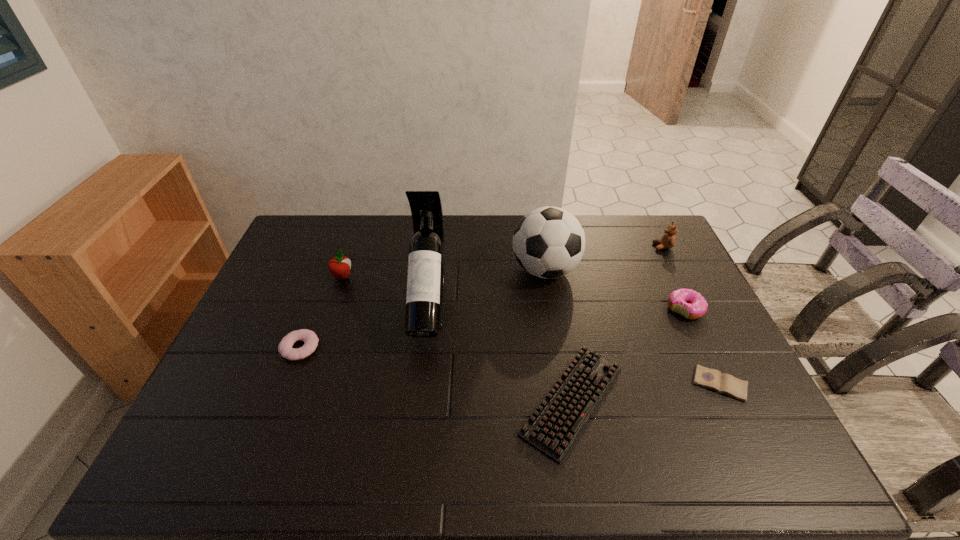
Locate an element on the screen. free point at the near edge is located at coordinates (565, 476).

Identify the location of free spot at the left edge of the desktop. (245, 369).

In order to click on vacant space at the right edge in this screenshot , I will do `click(770, 422)`.

The image size is (960, 540). In the image, there is a desktop. What are the coordinates of `free space at the far left corner` in the screenshot? It's located at (333, 233).

Find the location of `free spot between the nearer doughnut and the diary`. free spot between the nearer doughnut and the diary is located at coordinates (510, 366).

Where is `free space between the taller doughnut and the apple`? The width and height of the screenshot is (960, 540). free space between the taller doughnut and the apple is located at coordinates (514, 293).

At what (x,y) coordinates should I click in order to perform the action: click on vacant region between the shortest object and the third shortest object. Please return your answer as a coordinate pair (x, y). Looking at the image, I should click on (510, 366).

This screenshot has height=540, width=960. I want to click on free space between the teddy bear and the apple, so click(x=502, y=261).

What are the coordinates of `vacant space that's between the apple and the third object from left to right` in the screenshot? It's located at (386, 291).

Find the location of a particular element. The height and width of the screenshot is (540, 960). vacant area that lies between the teddy bear and the right doughnut is located at coordinates (674, 278).